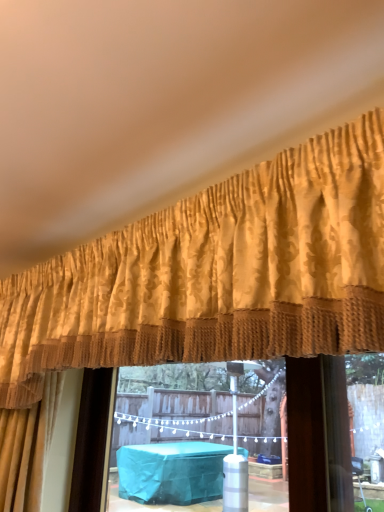
Describe the element at coordinates (193, 433) in the screenshot. I see `brown textured curtain at center` at that location.

Where is `brown textured curtain at center`? The height and width of the screenshot is (512, 384). brown textured curtain at center is located at coordinates click(193, 433).

Measure the distance between gold damask curtain at upper center and camera.

gold damask curtain at upper center is 20.73 inches from camera.

Describe the element at coordinates (217, 273) in the screenshot. I see `gold damask curtain at upper center` at that location.

At what (x,y) coordinates should I click in order to perform the action: click on gold damask curtain at upper center. Please return your answer as a coordinate pair (x, y). Looking at the image, I should click on (217, 273).

Locate an element on the screen. brown textured curtain at center is located at coordinates (193, 433).

Visually, is brown textured curtain at center positioned to the left or to the right of gold damask curtain at upper center?

Based on their positions, brown textured curtain at center is located to the right of gold damask curtain at upper center.

Does brown textured curtain at center lie behind gold damask curtain at upper center?

Yes, brown textured curtain at center is further from the camera.

Is point (134, 497) closer or farther from the camera than point (190, 305)?

Point (134, 497) is positioned farther from the camera compared to point (190, 305).

From the image's perspective, between brown textured curtain at center and gold damask curtain at upper center, which one is located above?

gold damask curtain at upper center is shown above in the image.

From a real-world perspective, which is physically below, brown textured curtain at center or gold damask curtain at upper center?

brown textured curtain at center.

Looking at this image, does brown textured curtain at center have a lesser width compared to gold damask curtain at upper center?

Correct, the width of brown textured curtain at center is less than that of gold damask curtain at upper center.

Which of these two, brown textured curtain at center or gold damask curtain at upper center, stands taller?

brown textured curtain at center is taller.

Looking at the image, does brown textured curtain at center seem bigger or smaller compared to gold damask curtain at upper center?

Considering their sizes, brown textured curtain at center takes up less space than gold damask curtain at upper center.

Is brown textured curtain at center inside or outside of gold damask curtain at upper center?

brown textured curtain at center is located beyond the bounds of gold damask curtain at upper center.

Does brown textured curtain at center touch gold damask curtain at upper center?

No, brown textured curtain at center is not with gold damask curtain at upper center.

Does brown textured curtain at center turn towards gold damask curtain at upper center?

Yes, brown textured curtain at center is oriented towards gold damask curtain at upper center.

This screenshot has height=512, width=384. I want to click on curtain on the left of brown textured curtain at center, so click(x=217, y=273).

Is gold damask curtain at upper center to the right of brown textured curtain at center from the viewer's perspective?

In fact, gold damask curtain at upper center is to the left of brown textured curtain at center.

Is gold damask curtain at upper center positioned behind brown textured curtain at center?

No, gold damask curtain at upper center is closer to the viewer.

Is point (75, 286) positioned after point (227, 445)?

No, (75, 286) is in front of (227, 445).

From the image's perspective, would you say gold damask curtain at upper center is positioned over brown textured curtain at center?

Yes, from the image's perspective, gold damask curtain at upper center is over brown textured curtain at center.

From a real-world perspective, between gold damask curtain at upper center and brown textured curtain at center, who is vertically higher?

gold damask curtain at upper center is physically above.

Which object is thinner, gold damask curtain at upper center or brown textured curtain at center?

brown textured curtain at center.

Considering the relative sizes of gold damask curtain at upper center and brown textured curtain at center in the image provided, is gold damask curtain at upper center taller than brown textured curtain at center?

No.

Is gold damask curtain at upper center bigger or smaller than brown textured curtain at center?

Clearly, gold damask curtain at upper center is larger in size than brown textured curtain at center.

Is gold damask curtain at upper center outside of brown textured curtain at center?

Yes, gold damask curtain at upper center is not within brown textured curtain at center.

Does gold damask curtain at upper center touch brown textured curtain at center?

No, gold damask curtain at upper center is not making contact with brown textured curtain at center.

Consider the image. Does gold damask curtain at upper center turn towards brown textured curtain at center?

No, gold damask curtain at upper center is not turned towards brown textured curtain at center.

This screenshot has width=384, height=512. What are the coordinates of `curtain in front of the brown textured curtain at center` in the screenshot? It's located at (217, 273).

The height and width of the screenshot is (512, 384). In order to click on window frame behind the gold damask curtain at upper center in this screenshot , I will do `click(193, 433)`.

Locate an element on the screen. This screenshot has height=512, width=384. window frame on the right of the gold damask curtain at upper center is located at coordinates (193, 433).